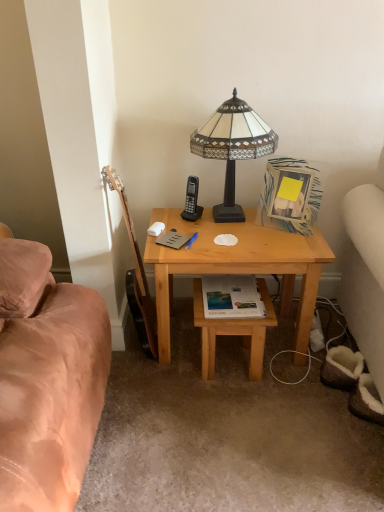
Find the location of `vacant region above light wood desk at center (from a real-world perspective)`. vacant region above light wood desk at center (from a real-world perspective) is located at coordinates (229, 227).